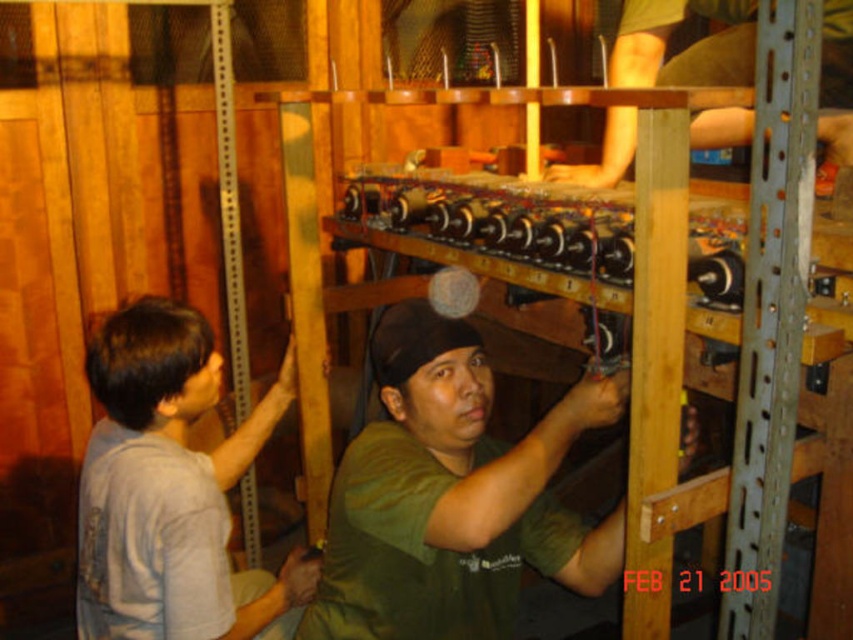
You are a worker in the workshop and need to pass through the narrow doorway between the gray cotton shirt at left and the green matte shirt at upper center. Can you fit through the space between them?

The gray cotton shirt at left has a lesser width compared to green matte shirt at upper center, so the space between them might be narrower than expected. However, since the gray cotton shirt at left is narrower, the total width between them may still allow passage depending on the doorway dimensions. Without specific measurements of the doorway, it is uncertain if you can fit through.